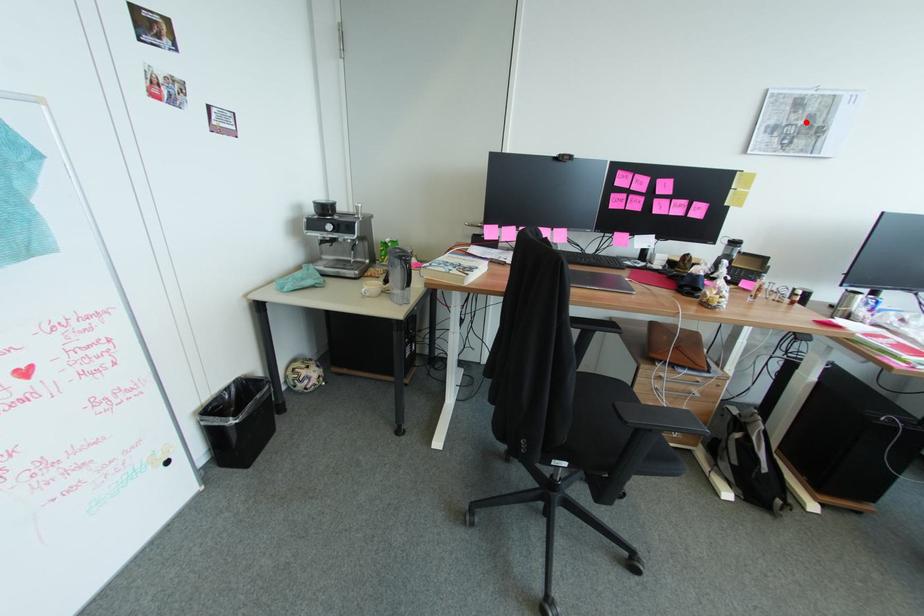
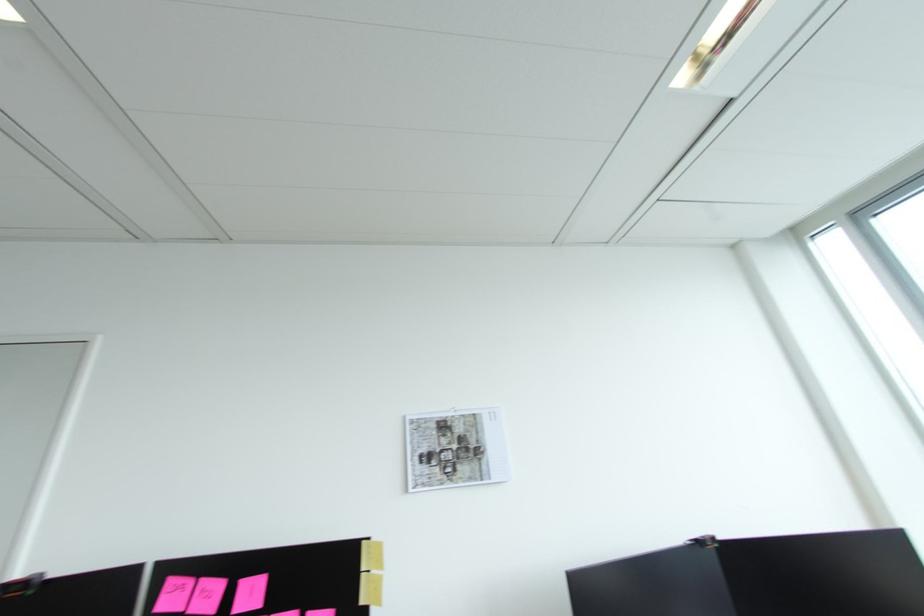
The point at the highlighted location is marked in the first image. Where is the corresponding point in the second image?

(459, 446)